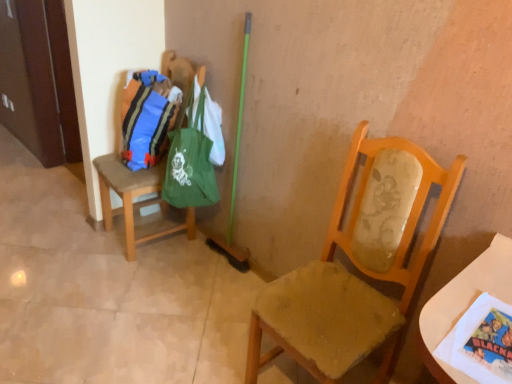
The width and height of the screenshot is (512, 384). Describe the element at coordinates (463, 304) in the screenshot. I see `white paper at lower right` at that location.

At what (x,y) coordinates should I click in order to perform the action: click on matte blue fabric bag at left, placed as the first bag when sorted from left to right. Please return your answer as a coordinate pair (x, y). This screenshot has height=384, width=512. Looking at the image, I should click on (146, 120).

Locate an element on the screen. The height and width of the screenshot is (384, 512). green fabric bag at upper left, placed as the 1th bag when sorted from right to left is located at coordinates (190, 163).

Where is `white paper at lower right`? Image resolution: width=512 pixels, height=384 pixels. white paper at lower right is located at coordinates (463, 304).

Is green fabric bag at upper left, placed as the 1th bag when sorted from right to left, shorter than wooden chair at center, the first chair in the front-to-back sequence?

Yes.

From the image's perspective, who appears lower, green fabric bag at upper left, placed as the 1th bag when sorted from right to left, or wooden chair at center, which is the 2th chair in back-to-front order?

wooden chair at center, which is the 2th chair in back-to-front order.

Is green fabric bag at upper left, placed as the 1th bag when sorted from right to left, to the right of wooden chair at center, which is the 2th chair in back-to-front order, from the viewer's perspective?

Incorrect, green fabric bag at upper left, placed as the 1th bag when sorted from right to left, is not on the right side of wooden chair at center, which is the 2th chair in back-to-front order.

Looking at this image, is wooden chair at center, positioned as the 2th chair in left-to-right order, completely or partially outside of brown fabric chair at left, placed as the first chair when sorted from left to right?

Indeed, wooden chair at center, positioned as the 2th chair in left-to-right order, is completely outside brown fabric chair at left, placed as the first chair when sorted from left to right.

From the image's perspective, between wooden chair at center, positioned as the 2th chair in left-to-right order, and brown fabric chair at left, marked as the second chair in a front-to-back arrangement, who is located below?

wooden chair at center, positioned as the 2th chair in left-to-right order, from the image's perspective.

From a real-world perspective, does wooden chair at center, which is counted as the first chair, starting from the right, sit lower than brown fabric chair at left, acting as the 1th chair starting from the back?

No, from a real-world perspective, wooden chair at center, which is counted as the first chair, starting from the right, is not below brown fabric chair at left, acting as the 1th chair starting from the back.

Who is bigger, wooden chair at center, which is the 2th chair in back-to-front order, or white paper at lower right?

Bigger between the two is wooden chair at center, which is the 2th chair in back-to-front order.

Could white paper at lower right be considered to be inside wooden chair at center, which is counted as the first chair, starting from the right?

No.

Does wooden chair at center, the first chair in the front-to-back sequence, come behind white paper at lower right?

Yes, it is behind white paper at lower right.

In the scene shown: Does green fabric bag at upper left, placed as the 1th bag when sorted from right to left, appear on the right side of matte blue fabric bag at left, placed as the first bag when sorted from left to right?

Correct, you'll find green fabric bag at upper left, placed as the 1th bag when sorted from right to left, to the right of matte blue fabric bag at left, placed as the first bag when sorted from left to right.

From the image's perspective, would you say green fabric bag at upper left, placed as the 1th bag when sorted from right to left, is shown under matte blue fabric bag at left, the 2th bag in the right-to-left sequence?

Indeed, from the image's perspective, green fabric bag at upper left, placed as the 1th bag when sorted from right to left, is shown beneath matte blue fabric bag at left, the 2th bag in the right-to-left sequence.

Based on the photo, between green fabric bag at upper left, placed as the 1th bag when sorted from right to left, and matte blue fabric bag at left, the 2th bag in the right-to-left sequence, which one has smaller size?

Smaller between the two is matte blue fabric bag at left, the 2th bag in the right-to-left sequence.

Considering the relative sizes of green fabric bag at upper left, placed as the 1th bag when sorted from right to left, and matte blue fabric bag at left, the 2th bag in the right-to-left sequence, in the image provided, is green fabric bag at upper left, placed as the 1th bag when sorted from right to left, wider than matte blue fabric bag at left, the 2th bag in the right-to-left sequence,?

Yes.

In terms of width, does brown fabric chair at left, placed as the first chair when sorted from left to right, look wider or thinner when compared to wooden chair at center, which is counted as the first chair, starting from the right?

Considering their sizes, brown fabric chair at left, placed as the first chair when sorted from left to right, looks broader than wooden chair at center, which is counted as the first chair, starting from the right.

Which is closer to the camera, (158, 177) or (325, 361)?

The point (325, 361) is in front.

Between brown fabric chair at left, placed as the first chair when sorted from left to right, and wooden chair at center, positioned as the 2th chair in left-to-right order, which one is positioned in front?

Positioned in front is wooden chair at center, positioned as the 2th chair in left-to-right order.

Can you tell me how much brown fabric chair at left, marked as the second chair in a front-to-back arrangement, and wooden chair at center, positioned as the 2th chair in left-to-right order, differ in facing direction?

They differ by 2.81 degrees in their facing directions.

Can you tell me how much brown fabric chair at left, which appears as the second chair when viewed from the right, and white paper at lower right differ in facing direction?

There is a 8.02-degree angle between the facing directions of brown fabric chair at left, which appears as the second chair when viewed from the right, and white paper at lower right.

From a real-world perspective, is brown fabric chair at left, which appears as the second chair when viewed from the right, located higher than white paper at lower right?

No, from a real-world perspective, brown fabric chair at left, which appears as the second chair when viewed from the right, is not on top of white paper at lower right.

Which object is positioned more to the right, brown fabric chair at left, marked as the second chair in a front-to-back arrangement, or white paper at lower right?

From the viewer's perspective, white paper at lower right appears more on the right side.

Can you confirm if brown fabric chair at left, acting as the 1th chair starting from the back, is wider than white paper at lower right?

Yes, brown fabric chair at left, acting as the 1th chair starting from the back, is wider than white paper at lower right.

Looking at this image, from a real-world perspective, is brown fabric chair at left, placed as the first chair when sorted from left to right, on matte blue fabric bag at left, the 2th bag in the right-to-left sequence?

No, from a real-world perspective, brown fabric chair at left, placed as the first chair when sorted from left to right, is not on top of matte blue fabric bag at left, the 2th bag in the right-to-left sequence.

How many degrees apart are the facing directions of brown fabric chair at left, placed as the first chair when sorted from left to right, and matte blue fabric bag at left, the 2th bag in the right-to-left sequence?

They differ by 2.17 degrees in their facing directions.

Which is in front, brown fabric chair at left, which appears as the second chair when viewed from the right, or matte blue fabric bag at left, placed as the first bag when sorted from left to right?

brown fabric chair at left, which appears as the second chair when viewed from the right.

Which is in front, point (181, 75) or point (130, 93)?

The point (130, 93) is closer.

Image resolution: width=512 pixels, height=384 pixels. What are the coordinates of `chair that is the 1st object directly below the green fabric bag at upper left, marked as the second bag in a left-to-right arrangement (from a real-world perspective)` in the screenshot? It's located at (357, 266).

Where is `chair that is below the brown fabric chair at left, which appears as the second chair when viewed from the right (from the image's perspective)`? chair that is below the brown fabric chair at left, which appears as the second chair when viewed from the right (from the image's perspective) is located at coordinates (357, 266).

Looking at the image, which one is located closer to brown fabric chair at left, placed as the first chair when sorted from left to right, green fabric bag at upper left, placed as the 1th bag when sorted from right to left, or wooden chair at center, positioned as the 2th chair in left-to-right order?

green fabric bag at upper left, placed as the 1th bag when sorted from right to left.

When comparing their distances from brown fabric chair at left, acting as the 1th chair starting from the back, does green fabric bag at upper left, marked as the second bag in a left-to-right arrangement, or matte blue fabric bag at left, placed as the first bag when sorted from left to right, seem closer?

matte blue fabric bag at left, placed as the first bag when sorted from left to right, is positioned closer to the anchor brown fabric chair at left, acting as the 1th chair starting from the back.

Considering their positions, is brown fabric chair at left, which appears as the second chair when viewed from the right, positioned further to wooden chair at center, positioned as the 2th chair in left-to-right order, than matte blue fabric bag at left, placed as the first bag when sorted from left to right?

matte blue fabric bag at left, placed as the first bag when sorted from left to right, is positioned further to the anchor wooden chair at center, positioned as the 2th chair in left-to-right order.

Looking at the image, which one is located further to matte blue fabric bag at left, the 2th bag in the right-to-left sequence, white paper at lower right or green fabric bag at upper left, marked as the second bag in a left-to-right arrangement?

Among the two, white paper at lower right is located further to matte blue fabric bag at left, the 2th bag in the right-to-left sequence.

Based on the photo, from the image, which object appears to be nearer to matte blue fabric bag at left, the 2th bag in the right-to-left sequence, brown fabric chair at left, marked as the second chair in a front-to-back arrangement, or wooden chair at center, the first chair in the front-to-back sequence?

Based on the image, brown fabric chair at left, marked as the second chair in a front-to-back arrangement, appears to be nearer to matte blue fabric bag at left, the 2th bag in the right-to-left sequence.

Which object lies nearer to the anchor point brown fabric chair at left, placed as the first chair when sorted from left to right, white paper at lower right or green fabric bag at upper left, placed as the 1th bag when sorted from right to left?

The object closer to brown fabric chair at left, placed as the first chair when sorted from left to right, is green fabric bag at upper left, placed as the 1th bag when sorted from right to left.

When comparing their distances from white paper at lower right, does green fabric bag at upper left, marked as the second bag in a left-to-right arrangement, or wooden chair at center, the first chair in the front-to-back sequence, seem closer?

wooden chair at center, the first chair in the front-to-back sequence, is positioned closer to the anchor white paper at lower right.

Looking at the image, which one is located closer to green fabric bag at upper left, marked as the second bag in a left-to-right arrangement, white paper at lower right or matte blue fabric bag at left, placed as the first bag when sorted from left to right?

Based on the image, matte blue fabric bag at left, placed as the first bag when sorted from left to right, appears to be nearer to green fabric bag at upper left, marked as the second bag in a left-to-right arrangement.

Find the location of `bag located between wooden chair at center, positioned as the 2th chair in left-to-right order, and matte blue fabric bag at left, placed as the first bag when sorted from left to right, in the depth direction`. bag located between wooden chair at center, positioned as the 2th chair in left-to-right order, and matte blue fabric bag at left, placed as the first bag when sorted from left to right, in the depth direction is located at coordinates (190, 163).

Where is `chair positioned between wooden chair at center, the first chair in the front-to-back sequence, and matte blue fabric bag at left, the 2th bag in the right-to-left sequence, from near to far`? The width and height of the screenshot is (512, 384). chair positioned between wooden chair at center, the first chair in the front-to-back sequence, and matte blue fabric bag at left, the 2th bag in the right-to-left sequence, from near to far is located at coordinates (136, 197).

The height and width of the screenshot is (384, 512). I want to click on chair between brown fabric chair at left, placed as the first chair when sorted from left to right, and white paper at lower right, so click(x=357, y=266).

The image size is (512, 384). In order to click on bag between brown fabric chair at left, marked as the second chair in a front-to-back arrangement, and green fabric bag at upper left, marked as the second bag in a left-to-right arrangement in this screenshot , I will do `click(146, 120)`.